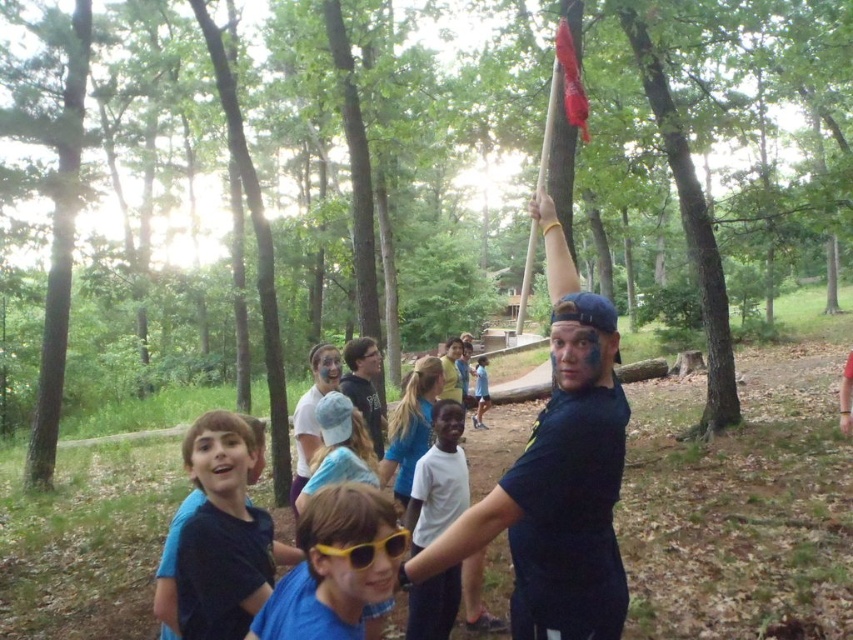
Is matte blue shirt at center above yellow plastic goggles at center?

No, matte blue shirt at center is not above yellow plastic goggles at center.

The height and width of the screenshot is (640, 853). Describe the element at coordinates (364, 387) in the screenshot. I see `matte blue shirt at center` at that location.

Identify the location of matte blue shirt at center. The height and width of the screenshot is (640, 853). (364, 387).

At what (x,y) coordinates should I click in order to perform the action: click on matte blue shirt at center. Please return your answer as a coordinate pair (x, y). This screenshot has height=640, width=853. Looking at the image, I should click on click(x=364, y=387).

Which is more to the left, dark blue t-shirt at center or yellow plastic goggles at center?

From the viewer's perspective, yellow plastic goggles at center appears more on the left side.

Is dark blue t-shirt at center positioned at the back of yellow plastic goggles at center?

Yes, it is.

Image resolution: width=853 pixels, height=640 pixels. What are the coordinates of `dark blue t-shirt at center` in the screenshot? It's located at (558, 476).

Which is below, white matte shirt at center or matte blue shirt at center?

white matte shirt at center is lower down.

Which is behind, point (433, 616) or point (378, 369)?

Point (378, 369)

Is point (451, 451) closer to camera compared to point (366, 388)?

Yes.

Locate an element on the screen. This screenshot has width=853, height=640. white matte shirt at center is located at coordinates (438, 477).